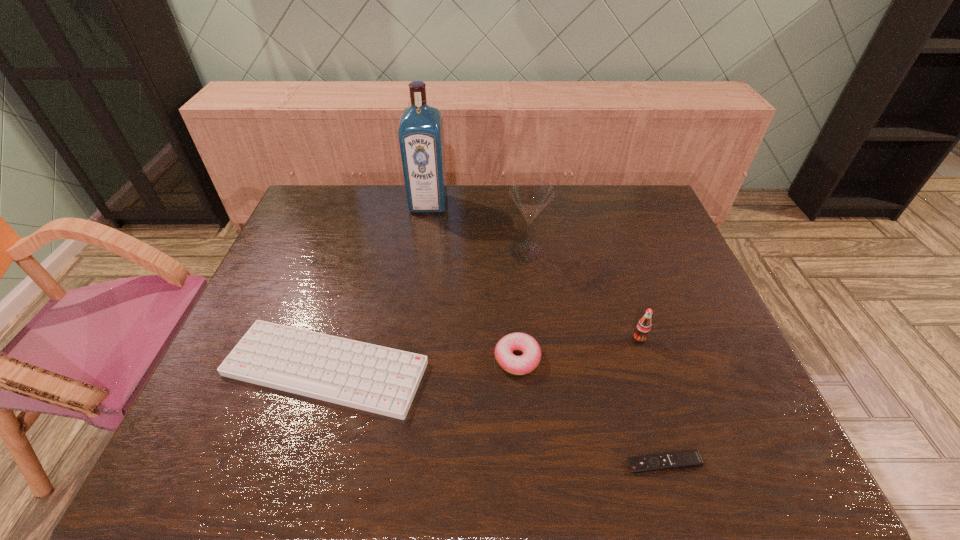
The height and width of the screenshot is (540, 960). In order to click on free space located on the left of the flute glass in this screenshot , I will do `click(440, 251)`.

I want to click on vacant space located 0.090m on the back of the third tallest object, so (x=629, y=308).

Find the location of a particular element. This screenshot has height=540, width=960. vacant space located 0.360m on the right of the third shortest object is located at coordinates (691, 359).

Find the location of `free space located 0.060m on the back of the second shortest object`. free space located 0.060m on the back of the second shortest object is located at coordinates (344, 308).

Locate an element on the screen. The width and height of the screenshot is (960, 540). free space located 0.070m on the back of the shortest object is located at coordinates (651, 421).

Find the location of a particular element. object that is at the far edge is located at coordinates (421, 138).

Locate an element on the screen. object located in the near edge section of the desktop is located at coordinates (687, 459).

Locate an element on the screen. This screenshot has height=540, width=960. object located at the left edge is located at coordinates (382, 380).

The width and height of the screenshot is (960, 540). Find the location of `vacant region at the far edge of the desktop`. vacant region at the far edge of the desktop is located at coordinates pyautogui.click(x=361, y=206).

Where is `vacant space at the near edge of the desktop`? This screenshot has width=960, height=540. vacant space at the near edge of the desktop is located at coordinates (399, 432).